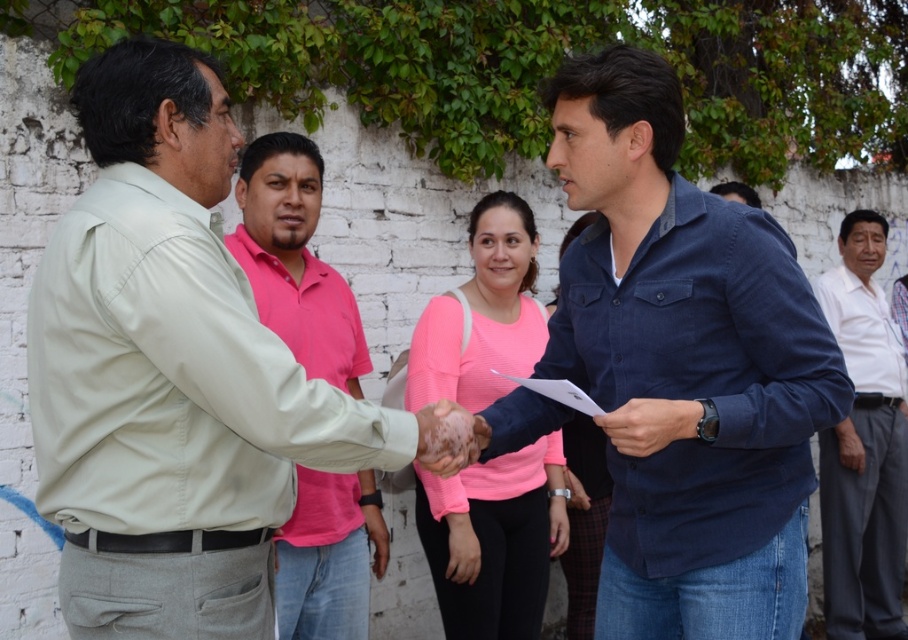
Question: Does blue denim shirt at center come behind pink cotton shirt at center?

Choices:
 (A) yes
 (B) no

Answer: (B)

Question: Among these points, which one is farthest from the camera?

Choices:
 (A) (166, 410)
 (B) (292, 556)
 (C) (796, 493)
 (D) (877, 609)

Answer: (D)

Question: Is light beige shirt at center above pink cotton shirt at center?

Choices:
 (A) yes
 (B) no

Answer: (B)

Question: Which of the following is the farthest from the observer?

Choices:
 (A) pink matte shirt at center
 (B) blue denim shirt at center
 (C) white cotton shirt at right
 (D) pink cotton shirt at center

Answer: (C)

Question: Does blue denim shirt at center have a lesser width compared to white cotton shirt at right?

Choices:
 (A) yes
 (B) no

Answer: (B)

Question: Among these objects, which one is nearest to the camera?

Choices:
 (A) pink cotton shirt at center
 (B) light beige shirt at center
 (C) white cotton shirt at right

Answer: (B)